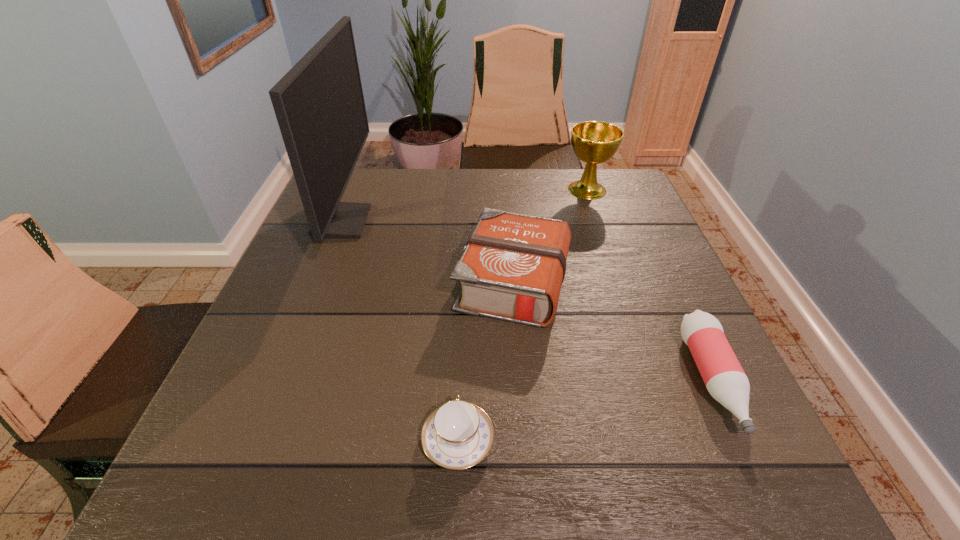
The width and height of the screenshot is (960, 540). In order to click on free point located 0.060m on the left of the Bible in this screenshot , I will do `click(425, 282)`.

The width and height of the screenshot is (960, 540). In order to click on vacant space positioned 0.370m on the side with the handle of the teacup in this screenshot , I will do click(x=465, y=265).

This screenshot has width=960, height=540. Identify the location of vacant space located on the side with the handle of the teacup. (465, 273).

You are a GUI agent. You are given a task and a screenshot of the screen. Output one action in this format:
    pyautogui.click(x=<x>, y=<y>)
    Task: Click on the free space located on the side with the handle of the teacup
    
    Given the screenshot: What is the action you would take?
    pyautogui.click(x=464, y=298)

The width and height of the screenshot is (960, 540). What are the coordinates of `computer monitor located at the far edge` in the screenshot? It's located at (319, 104).

Where is `chalice positioned at the far edge`? The width and height of the screenshot is (960, 540). chalice positioned at the far edge is located at coordinates (594, 142).

Locate an element on the screen. This screenshot has height=540, width=960. bottle at the near edge is located at coordinates (725, 380).

At what (x,y) coordinates should I click in order to perform the action: click on teacup that is at the near edge. Please return your answer as a coordinate pair (x, y). Looking at the image, I should click on (457, 435).

You are a GUI agent. You are given a task and a screenshot of the screen. Output one action in this format:
    pyautogui.click(x=<x>, y=<y>)
    Task: Click on the object located at the left edge
    
    Given the screenshot: What is the action you would take?
    pyautogui.click(x=319, y=104)

I want to click on chalice located in the right edge section of the desktop, so click(594, 142).